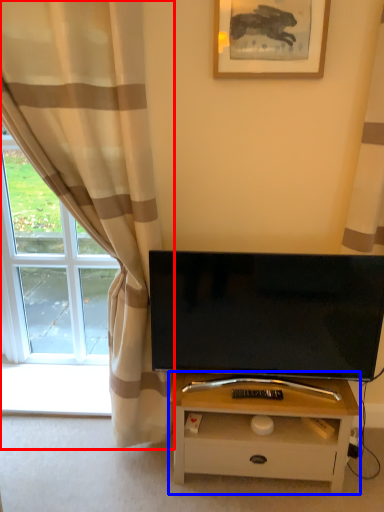
Question: Which object appears farthest to the camera in this image, curtain (highlighted by a red box) or table (highlighted by a blue box)?

Choices:
 (A) curtain
 (B) table

Answer: (B)